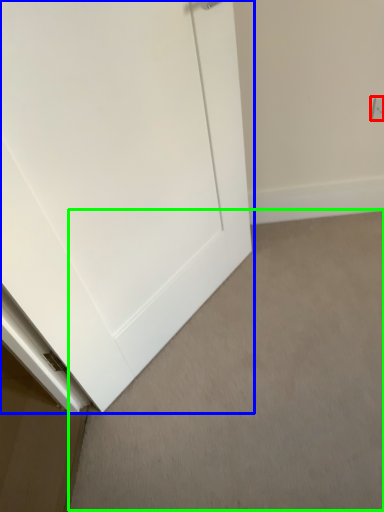
Question: Which object is the closest to the electric outlet (highlighted by a red box)? Choose among these: door (highlighted by a blue box) or plain (highlighted by a green box).

Choices:
 (A) door
 (B) plain

Answer: (A)